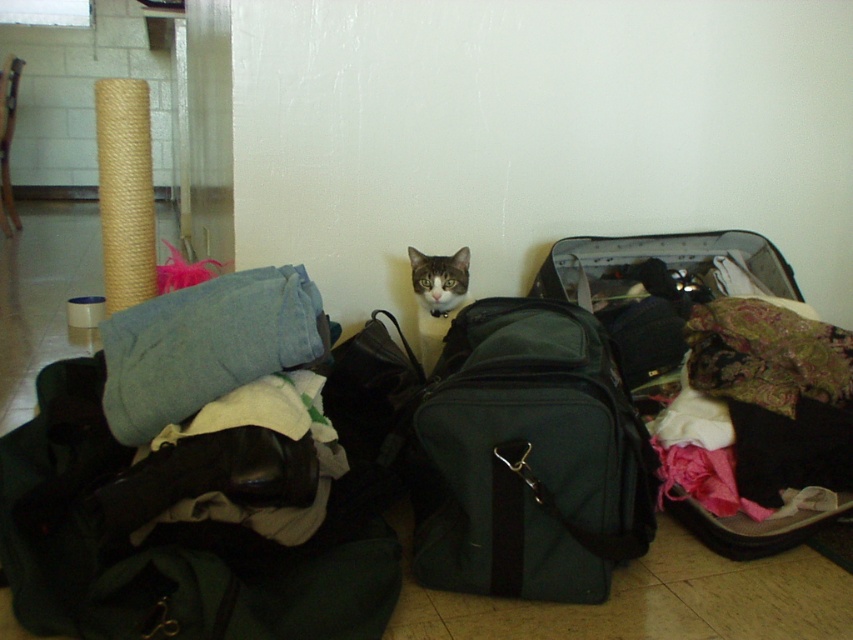
You are trying to locate the denim fabric at center in the image. What are its coordinates?

The denim fabric at center is located at coordinates point (206, 346).

You are organizing the items in the room and need to move the tabby fur cat at center to the right side of the denim fabric at center. Is this possible based on their current positions?

The denim fabric at center is currently to the left of the tabby fur cat at center. To move the cat to the right side of the denim fabric, you would need to position the cat further to the right so that the denim fabric is now on its left. This is possible as their positions can be adjusted.